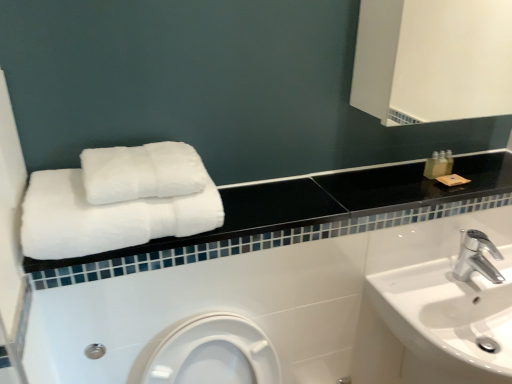
Question: Is silver metallic faucet at lower right situated inside white glossy sink at lower right or outside?

Choices:
 (A) inside
 (B) outside

Answer: (B)

Question: Based on their sizes in the image, would you say silver metallic faucet at lower right is bigger or smaller than white glossy sink at lower right?

Choices:
 (A) big
 (B) small

Answer: (B)

Question: Which object is positioned closest to the translucent plastic bottle at upper right?

Choices:
 (A) white soft towels at upper left
 (B) white fluffy towels at upper left, which is the 2th towel from top to bottom
 (C) silver metallic faucet at lower right
 (D) white glossy sink at lower right
 (E) white fluffy towels at center, acting as the 2th towel starting from the bottom

Answer: (C)

Question: Which is farther from the translucent plastic bottle at upper right?

Choices:
 (A) white fluffy towels at upper left, which is counted as the first towel, starting from the bottom
 (B) silver metallic faucet at lower right
 (C) white glossy sink at lower right
 (D) white soft towels at upper left
 (E) white fluffy towels at center, acting as the 2th towel starting from the bottom

Answer: (A)